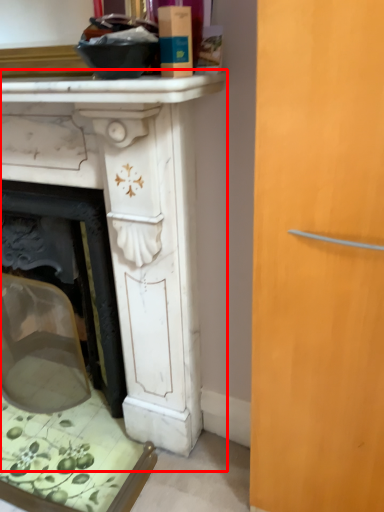
Question: From the image's perspective, considering the relative positions of table (annotated by the red box) and counter top in the image provided, where is table (annotated by the red box) located with respect to the staircase?

Choices:
 (A) above
 (B) below

Answer: (B)